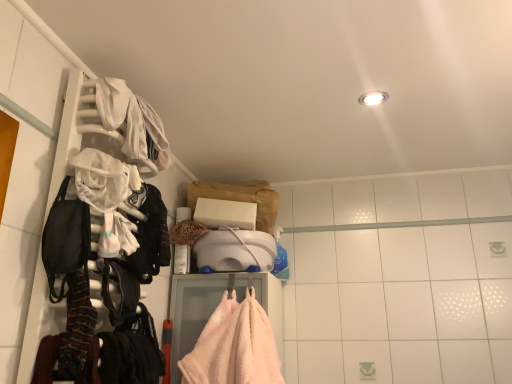
At what (x,y) coordinates should I click in order to perform the action: click on white fabric at upper left, the 2th clothing when ordered from bottom to top. Please return your answer as a coordinate pair (x, y). This screenshot has width=512, height=384. Looking at the image, I should click on (132, 122).

Image resolution: width=512 pixels, height=384 pixels. What do you see at coordinates (96, 225) in the screenshot?
I see `white plastic hanger at left` at bounding box center [96, 225].

Where is `striped wool scarf at left, the first clothing ordered from the bottom`? The image size is (512, 384). striped wool scarf at left, the first clothing ordered from the bottom is located at coordinates (71, 340).

Is striped wool scarf at left, which is the 2th clothing from top to bottom, taller or shorter than black fabric backpack at left?

In the image, striped wool scarf at left, which is the 2th clothing from top to bottom, appears to be taller than black fabric backpack at left.

Is striped wool scarf at left, the second clothing when ordered from back to front, bigger or smaller than black fabric backpack at left?

In the image, striped wool scarf at left, the second clothing when ordered from back to front, appears to be smaller than black fabric backpack at left.

Which is correct: striped wool scarf at left, the 1th clothing in the front-to-back sequence, is inside black fabric backpack at left, or outside of it?

striped wool scarf at left, the 1th clothing in the front-to-back sequence, cannot be found inside black fabric backpack at left.

In the image, is striped wool scarf at left, the second clothing when ordered from back to front, on the left side or the right side of black fabric backpack at left?

striped wool scarf at left, the second clothing when ordered from back to front, is positioned on black fabric backpack at left's right side.

Does black fabric backpack at left touch striped wool scarf at left, the first clothing ordered from the bottom?

Yes.

Considering the positions of objects black fabric backpack at left and striped wool scarf at left, the second clothing when ordered from back to front, in the image provided, who is in front, black fabric backpack at left or striped wool scarf at left, the second clothing when ordered from back to front,?

striped wool scarf at left, the second clothing when ordered from back to front, is in front.

Which object is thinner, black fabric backpack at left or striped wool scarf at left, the first clothing ordered from the bottom?

With smaller width is striped wool scarf at left, the first clothing ordered from the bottom.

Is striped wool scarf at left, the first clothing ordered from the bottom, a part of black fabric backpack at left?

No, black fabric backpack at left does not contain striped wool scarf at left, the first clothing ordered from the bottom.

Between white plastic hanger at left and striped wool scarf at left, which is the 2th clothing from top to bottom, which one has smaller width?

striped wool scarf at left, which is the 2th clothing from top to bottom, is thinner.

Is white plastic hanger at left at the right side of striped wool scarf at left, the first clothing ordered from the bottom?

No, white plastic hanger at left is not to the right of striped wool scarf at left, the first clothing ordered from the bottom.

Does point (127, 271) come closer to viewer compared to point (92, 347)?

No, (127, 271) is behind (92, 347).

From the image's perspective, is white plastic hanger at left below striped wool scarf at left, the first clothing ordered from the bottom?

No.

Consider the image. Between white fabric at upper left, the 2th clothing in the front-to-back sequence, and black fabric backpack at left, which one has more height?

black fabric backpack at left is taller.

Does point (96, 105) lie in front of point (54, 217)?

No, it is behind (54, 217).

Is the depth of white fabric at upper left, the 2th clothing when ordered from bottom to top, less than that of black fabric backpack at left?

No, white fabric at upper left, the 2th clothing when ordered from bottom to top, is further to the viewer.

From the image's perspective, relative to white fabric at upper left, the 2th clothing when ordered from bottom to top, is striped wool scarf at left, the 1th clothing in the front-to-back sequence, above or below?

Clearly, from the image's perspective, striped wool scarf at left, the 1th clothing in the front-to-back sequence, is below white fabric at upper left, the 2th clothing when ordered from bottom to top.

Would you say striped wool scarf at left, the second clothing when ordered from back to front, contains white fabric at upper left, marked as the first clothing in a top-to-bottom arrangement?

Actually, white fabric at upper left, marked as the first clothing in a top-to-bottom arrangement, is outside striped wool scarf at left, the second clothing when ordered from back to front.

Considering the sizes of objects striped wool scarf at left, which is the 2th clothing from top to bottom, and white fabric at upper left, marked as the first clothing in a top-to-bottom arrangement, in the image provided, who is taller, striped wool scarf at left, which is the 2th clothing from top to bottom, or white fabric at upper left, marked as the first clothing in a top-to-bottom arrangement,?

striped wool scarf at left, which is the 2th clothing from top to bottom.

Between point (46, 376) and point (154, 147), which one is positioned in front?

Point (46, 376)

Which is behind, point (56, 371) or point (74, 180)?

The point (74, 180) is farther.

Would you say striped wool scarf at left, which is the 2th clothing from top to bottom, is inside or outside white plastic hanger at left?

striped wool scarf at left, which is the 2th clothing from top to bottom, exists entirely within white plastic hanger at left.

From the image's perspective, is striped wool scarf at left, the second clothing when ordered from back to front, positioned above or below white plastic hanger at left?

From the image's perspective, striped wool scarf at left, the second clothing when ordered from back to front, appears below white plastic hanger at left.

Are striped wool scarf at left, the 1th clothing in the front-to-back sequence, and white plastic hanger at left located far from each other?

That's not correct — striped wool scarf at left, the 1th clothing in the front-to-back sequence, is a little close to white plastic hanger at left.

Is white plastic hanger at left aimed at black fabric backpack at left?

Yes, white plastic hanger at left is oriented towards black fabric backpack at left.

Where is `closet above the black fabric backpack at left (from the image's perspective)`? The width and height of the screenshot is (512, 384). closet above the black fabric backpack at left (from the image's perspective) is located at coordinates (96, 225).

Does white plastic hanger at left have a greater width compared to black fabric backpack at left?

Yes.

From the image's perspective, who appears lower, white plastic hanger at left or black fabric backpack at left?

black fabric backpack at left is shown below in the image.

I want to click on gear above the striped wool scarf at left, the 1th clothing in the front-to-back sequence (from the image's perspective), so click(65, 240).

Where is `clothing below the black fabric backpack at left (from the image's perspective)`? The image size is (512, 384). clothing below the black fabric backpack at left (from the image's perspective) is located at coordinates (71, 340).

Considering their positions, is white fabric at upper left, arranged as the first clothing when viewed from the back, positioned closer to white plastic hanger at left than striped wool scarf at left, the 1th clothing in the front-to-back sequence?

white fabric at upper left, arranged as the first clothing when viewed from the back.

Looking at the image, which one is located closer to striped wool scarf at left, the second clothing when ordered from back to front, white plastic hanger at left or white fabric at upper left, marked as the first clothing in a top-to-bottom arrangement?

white plastic hanger at left.

Considering their positions, is black fabric backpack at left positioned closer to white plastic hanger at left than white fabric at upper left, the 2th clothing when ordered from bottom to top?

black fabric backpack at left is closer to white plastic hanger at left.

Based on their spatial positions, is striped wool scarf at left, the first clothing ordered from the bottom, or white plastic hanger at left closer to white fabric at upper left, the 2th clothing in the front-to-back sequence?

The object closer to white fabric at upper left, the 2th clothing in the front-to-back sequence, is white plastic hanger at left.

When comparing their distances from black fabric backpack at left, does white fabric at upper left, marked as the first clothing in a top-to-bottom arrangement, or white plastic hanger at left seem further?

The object further to black fabric backpack at left is white fabric at upper left, marked as the first clothing in a top-to-bottom arrangement.

Which object lies nearer to the anchor point white fabric at upper left, arranged as the first clothing when viewed from the back, white plastic hanger at left or striped wool scarf at left, which is the 2th clothing from top to bottom?

The object closer to white fabric at upper left, arranged as the first clothing when viewed from the back, is white plastic hanger at left.

Looking at the image, which one is located closer to white fabric at upper left, arranged as the first clothing when viewed from the back, black fabric backpack at left or striped wool scarf at left, the 1th clothing in the front-to-back sequence?

Among the two, black fabric backpack at left is located nearer to white fabric at upper left, arranged as the first clothing when viewed from the back.

Looking at this image, when comparing their distances from black fabric backpack at left, does white plastic hanger at left or white fabric at upper left, marked as the first clothing in a top-to-bottom arrangement, seem further?

white fabric at upper left, marked as the first clothing in a top-to-bottom arrangement, is further to black fabric backpack at left.

The width and height of the screenshot is (512, 384). Find the location of `closet between white fabric at upper left, the 2th clothing in the front-to-back sequence, and striped wool scarf at left, the second clothing when ordered from back to front, in the vertical direction`. closet between white fabric at upper left, the 2th clothing in the front-to-back sequence, and striped wool scarf at left, the second clothing when ordered from back to front, in the vertical direction is located at coordinates (96, 225).

Locate an element on the screen. Image resolution: width=512 pixels, height=384 pixels. closet between white fabric at upper left, the 2th clothing when ordered from bottom to top, and black fabric backpack at left, in the vertical direction is located at coordinates (96, 225).

Locate an element on the screen. gear between white fabric at upper left, the 2th clothing when ordered from bottom to top, and striped wool scarf at left, the 1th clothing in the front-to-back sequence, from top to bottom is located at coordinates (65, 240).

Where is `gear between white plastic hanger at left and striped wool scarf at left, which is the 2th clothing from top to bottom, in the vertical direction`? gear between white plastic hanger at left and striped wool scarf at left, which is the 2th clothing from top to bottom, in the vertical direction is located at coordinates (65, 240).